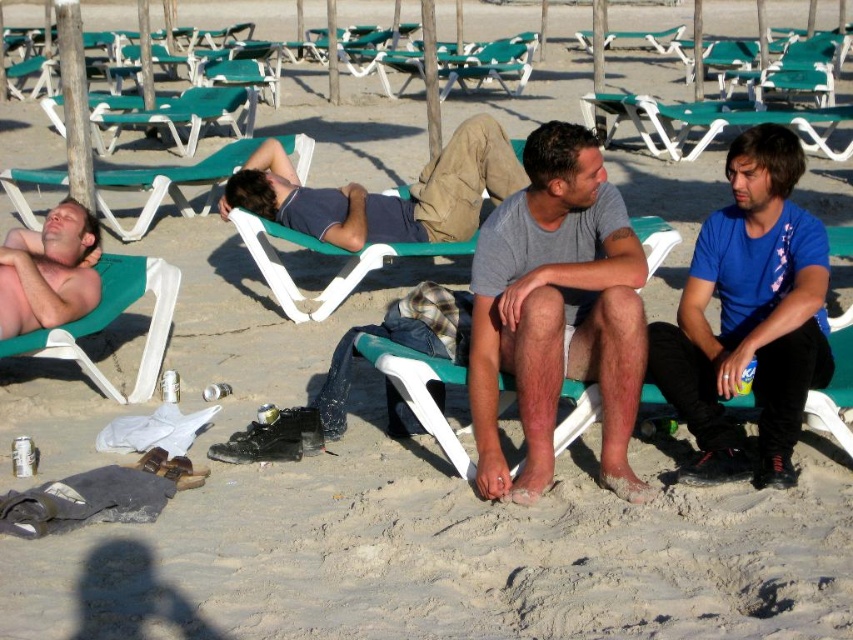
Is point (502, 259) closer to viewer compared to point (28, 260)?

Yes.

Can you confirm if gray matte shirt at center is shorter than shiny skin at left?

In fact, gray matte shirt at center may be taller than shiny skin at left.

Which is in front, point (473, 364) or point (97, 282)?

Point (473, 364) is in front.

I want to click on gray matte shirt at center, so click(x=556, y=312).

Which is more to the right, matte blue shirt at center or green plastic lounge chair at upper left?

matte blue shirt at center

Is point (273, 205) farther from camera compared to point (126, 237)?

No, (273, 205) is closer to viewer.

This screenshot has width=853, height=640. In order to click on matte blue shirt at center in this screenshot , I will do `click(383, 193)`.

Who is taller, shiny skin at left or green plastic lounge chair at upper left?

green plastic lounge chair at upper left is taller.

Which is more to the left, shiny skin at left or green plastic lounge chair at upper left?

Positioned to the left is shiny skin at left.

Which is in front, point (71, 262) or point (51, 170)?

Point (71, 262)

At what (x,y) coordinates should I click in order to perform the action: click on shiny skin at left. Please return your answer as a coordinate pair (x, y). Looking at the image, I should click on (49, 272).